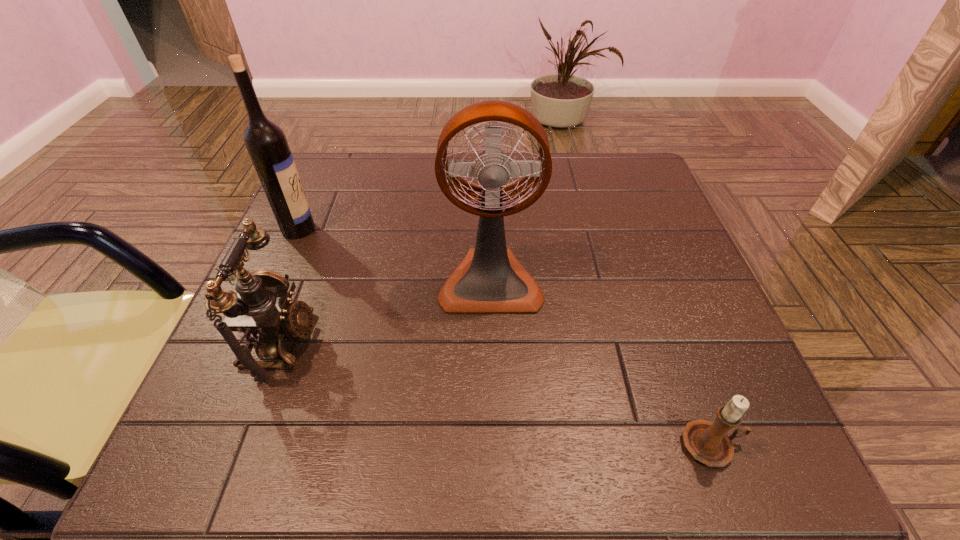
You are a GUI agent. You are given a task and a screenshot of the screen. Output one action in this format:
    pyautogui.click(x=<x>, y=<y>)
    Task: Click on the farthest object
    The image size is (960, 540).
    Given the screenshot: What is the action you would take?
    pyautogui.click(x=266, y=143)

Locate an element on the screen. the second object from right to left is located at coordinates (490, 279).

I want to click on telephone, so click(261, 310).

Where is `candle holder`? The height and width of the screenshot is (540, 960). candle holder is located at coordinates (708, 442).

What are the coordinates of `the nearest object` in the screenshot? It's located at pos(708,442).

You are a GUI agent. You are given a task and a screenshot of the screen. Output one action in this format:
    pyautogui.click(x=<x>, y=<y>)
    Task: Click on the vacant area situated on the label of the farthest object
    This screenshot has height=540, width=960.
    Given the screenshot: What is the action you would take?
    pyautogui.click(x=377, y=229)

Locate an element on the screen. vacant space located on the front-facing side of the fan is located at coordinates [x=494, y=451].

The width and height of the screenshot is (960, 540). Find the location of `vacant space positioned on the rotary dial of the second shortest object`. vacant space positioned on the rotary dial of the second shortest object is located at coordinates (441, 343).

This screenshot has width=960, height=540. In order to click on free location located on the side of the candle holder with the handle in this screenshot , I will do `click(777, 445)`.

You are a GUI agent. You are given a task and a screenshot of the screen. Output one action in this format:
    pyautogui.click(x=<x>, y=<y>)
    Task: Click on the object located in the near edge section of the desktop
    
    Given the screenshot: What is the action you would take?
    pyautogui.click(x=708, y=442)